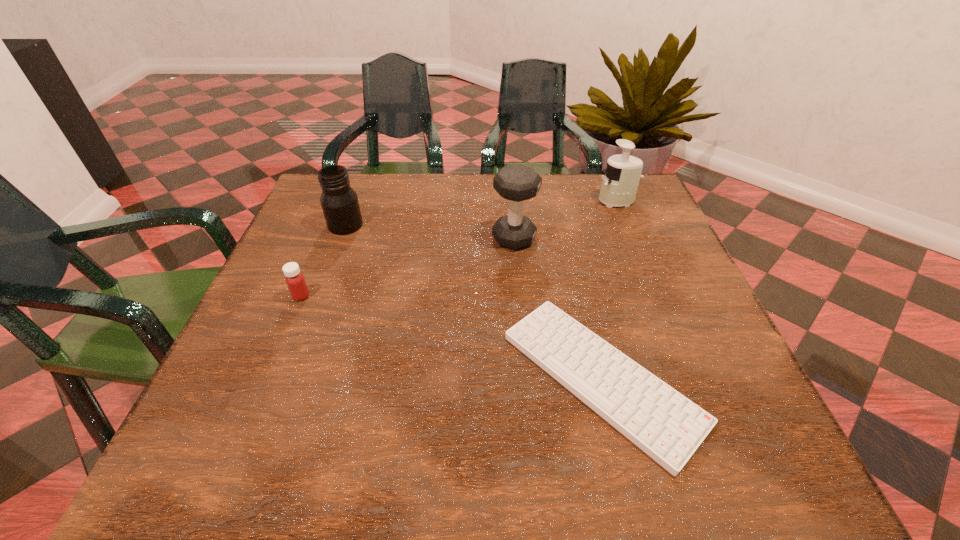
Find the location of `unoccupied area between the juicer and the jar`. unoccupied area between the juicer and the jar is located at coordinates tap(481, 213).

This screenshot has height=540, width=960. Find the location of `vacant space that's between the fourth farthest object and the dumbbell`. vacant space that's between the fourth farthest object and the dumbbell is located at coordinates (408, 267).

I want to click on free point between the medicine and the nearest object, so click(451, 337).

The height and width of the screenshot is (540, 960). Identify the location of vacant area between the medicine and the dumbbell. pos(408,267).

Select which object is the second closest to the jar. Please provide its 2D coordinates. Your answer should be formatted as a tuple, i.e. [(x, y)], where the tuple contains the x and y coordinates of a point satisfying the conditions above.

[(516, 183)]

I want to click on object that is the nearest to the shortest object, so click(x=516, y=183).

Find the location of `vacant space that satisfies the following two spatial constraints: 1. on the back side of the jar; 2. on the left side of the fourth tallest object`. vacant space that satisfies the following two spatial constraints: 1. on the back side of the jar; 2. on the left side of the fourth tallest object is located at coordinates (330, 225).

The width and height of the screenshot is (960, 540). Find the location of `free region that satisfies the following two spatial constraints: 1. on the back side of the juicer; 2. on the left side of the medicine`. free region that satisfies the following two spatial constraints: 1. on the back side of the juicer; 2. on the left side of the medicine is located at coordinates (341, 201).

Where is `vacant space that satisfies the following two spatial constraints: 1. on the front side of the computer keyboard; 2. on the left side of the dumbbell`? This screenshot has width=960, height=540. vacant space that satisfies the following two spatial constraints: 1. on the front side of the computer keyboard; 2. on the left side of the dumbbell is located at coordinates (527, 378).

Where is `free space in the image that satisfies the following two spatial constraints: 1. on the front side of the jar; 2. on the left side of the dumbbell`? The image size is (960, 540). free space in the image that satisfies the following two spatial constraints: 1. on the front side of the jar; 2. on the left side of the dumbbell is located at coordinates (341, 238).